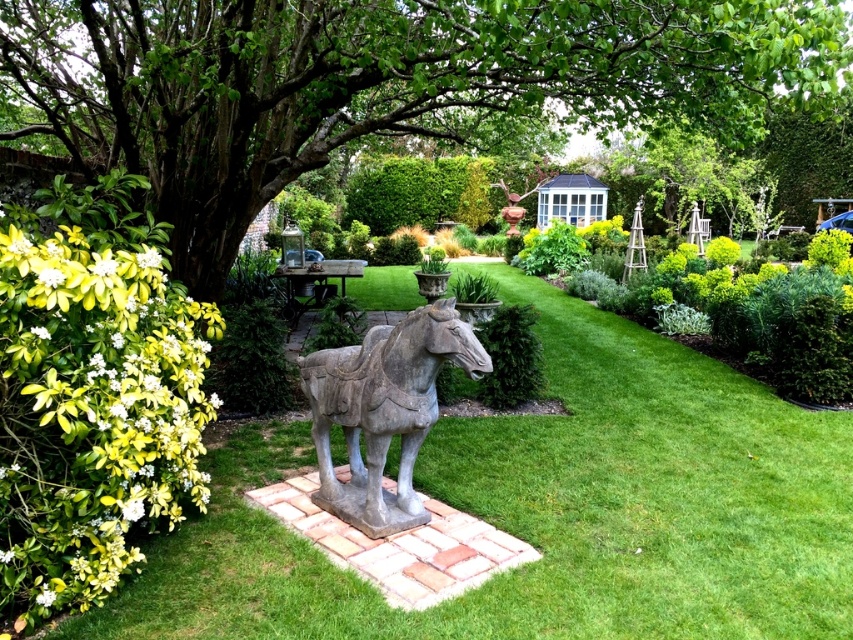
You are standing in the garden and want to take a photo of the green leafy tree at upper left. The camera you are using has a zoom lens that can focus on objects within a 0.1 radius from the center point. If you center your camera on point (378, 83), will the green leafy tree at upper left be in focus?

The point (378, 83) marks the green leafy tree at upper left. Since the camera can focus within a 0.1 radius from the center point, the tree will be in focus as the center is exactly on the tree.

You are a gardener who wants to plant a new flower bed between the green grass at center and the gray stone horse at center. Considering their heights, which object should the flower bed be placed closer to for better visibility?

The flower bed should be placed closer to the green grass at center because it has a lesser height compared to the gray stone horse at center, allowing the flowers to be more visible without being overshadowed.

You are a gardener planning to mow the green grass at center and clean the gray stone horse at center. Which area requires more time to maintain based on their sizes?

The gray stone horse at center requires more time to maintain because it occupies more space than the green grass at center.